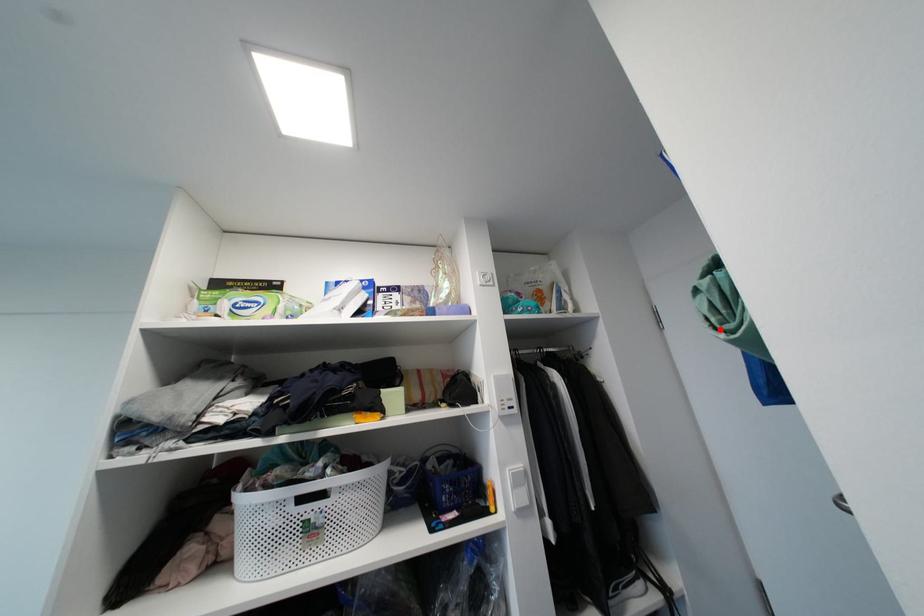
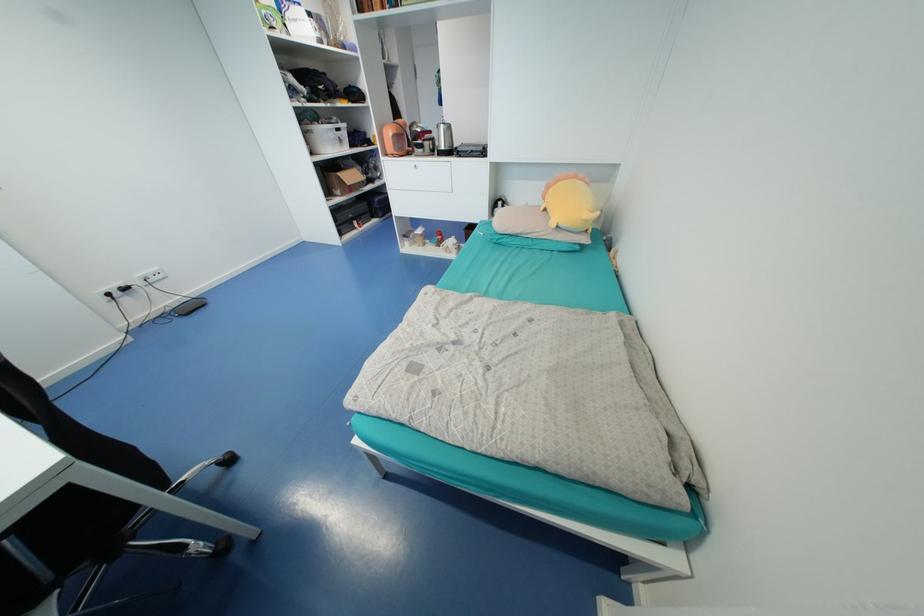
Question: I am providing you with two images of the same scene from different viewpoints. A red point is marked on the first image. Is the red point's position out of view in image 2?

Choices:
 (A) Yes
 (B) No

Answer: (A)